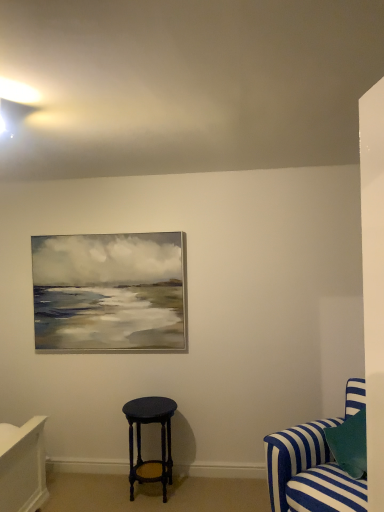
Locate an element on the screen. Image resolution: width=384 pixels, height=512 pixels. free space above matte dark blue stool at center (from a real-world perspective) is located at coordinates (147, 403).